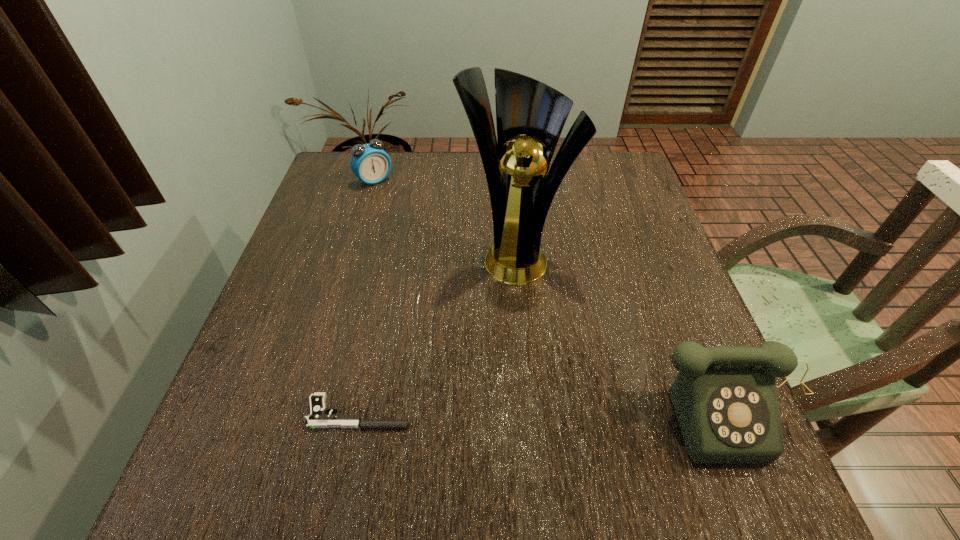
The width and height of the screenshot is (960, 540). I want to click on vacant point located between the telephone and the second shortest object, so click(x=556, y=294).

Where is `vacant space that is in between the award and the third shortest object`? Image resolution: width=960 pixels, height=540 pixels. vacant space that is in between the award and the third shortest object is located at coordinates (626, 331).

The height and width of the screenshot is (540, 960). I want to click on free space between the shortest object and the award, so click(x=437, y=333).

Where is `unoccupied position between the alarm clock and the shortest object`? The width and height of the screenshot is (960, 540). unoccupied position between the alarm clock and the shortest object is located at coordinates (367, 296).

Find the location of a particular element. This screenshot has width=960, height=540. unoccupied position between the pistol and the second shortest object is located at coordinates (367, 296).

Find the location of a particular element. vacant space in between the second shortest object and the pistol is located at coordinates (367, 296).

Locate an element on the screen. free space between the third tallest object and the telephone is located at coordinates (556, 294).

This screenshot has width=960, height=540. What are the coordinates of `free area in between the shortest object and the second farthest object` in the screenshot? It's located at (437, 333).

The height and width of the screenshot is (540, 960). In order to click on object that is the second closest one to the telephone in this screenshot , I will do `click(318, 418)`.

Identify which object is the second closest to the alarm clock. Please provide its 2D coordinates. Your answer should be formatted as a tuple, i.e. [(x, y)], where the tuple contains the x and y coordinates of a point satisfying the conditions above.

[(318, 418)]